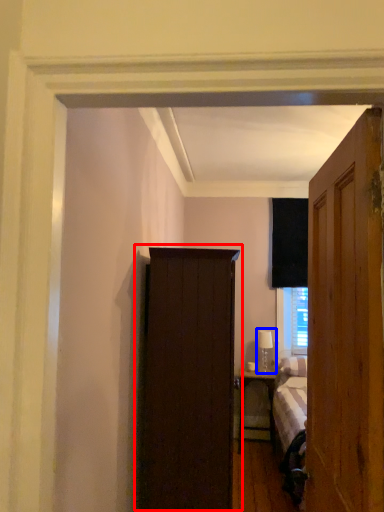
Question: Which object appears farthest to the camera in this image, cupboard (highlighted by a red box) or table lamp (highlighted by a blue box)?

Choices:
 (A) cupboard
 (B) table lamp

Answer: (B)